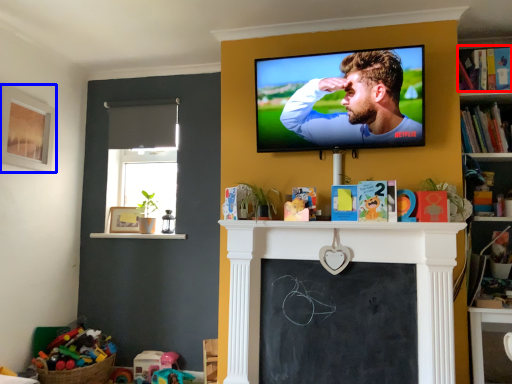
Question: Which object appears farthest to the camera in this image, book (highlighted by a red box) or picture frame (highlighted by a blue box)?

Choices:
 (A) book
 (B) picture frame

Answer: (B)